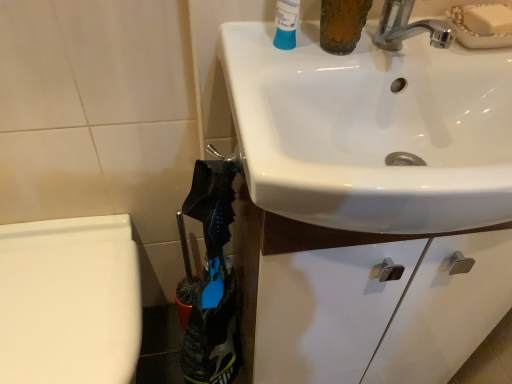
I want to click on blank space situated above white glossy bidet at lower left (from a real-world perspective), so click(64, 300).